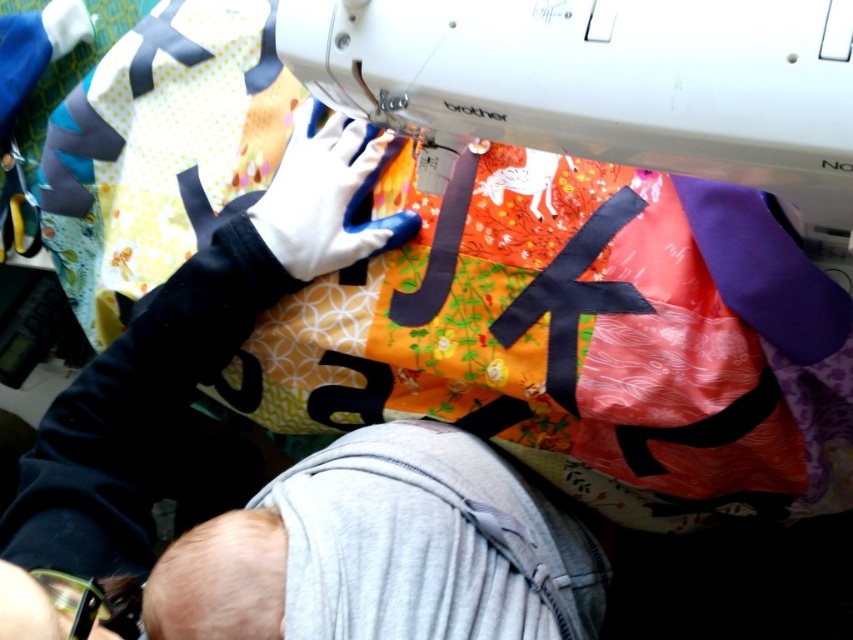
This screenshot has height=640, width=853. I want to click on white plastic sewing machine at upper center, so tap(604, 83).

Which of these two, white plastic sewing machine at upper center or gray soft baby at lower center, stands shorter?

Standing shorter between the two is white plastic sewing machine at upper center.

Identify the location of white plastic sewing machine at upper center. Image resolution: width=853 pixels, height=640 pixels. (604, 83).

The height and width of the screenshot is (640, 853). Identify the location of white plastic sewing machine at upper center. (604, 83).